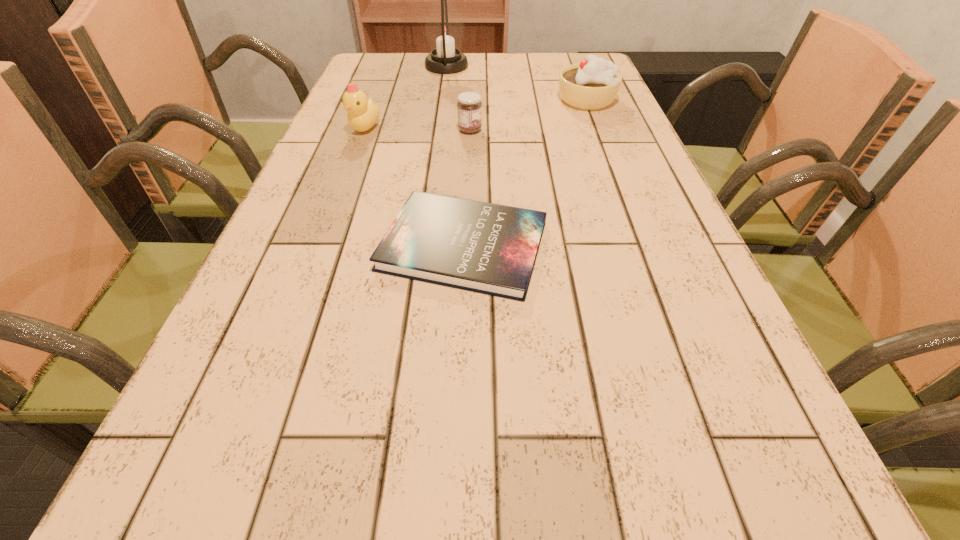
Locate an element on the screen. The width and height of the screenshot is (960, 540). vacant space situated 0.170m on the front-facing side of the leftmost object is located at coordinates [346, 180].

Where is `vacant point located 0.080m on the front label of the fourth tallest object`? The image size is (960, 540). vacant point located 0.080m on the front label of the fourth tallest object is located at coordinates (515, 130).

Identify the location of blank space located on the right of the hardback book. (643, 246).

This screenshot has width=960, height=540. I want to click on object at the far edge, so click(444, 28).

What are the coordinates of `object that is positioned at the left edge` in the screenshot? It's located at (362, 115).

What are the coordinates of `object situated at the right edge` in the screenshot? It's located at (593, 84).

At what (x,y) coordinates should I click in order to perform the action: click on vacant space at the far edge of the desktop. Please return your answer as a coordinate pair (x, y). This screenshot has height=540, width=960. Looking at the image, I should click on (494, 83).

Find the location of a particular element. blank space at the left edge of the desktop is located at coordinates (341, 249).

Where is `vacant space at the right edge`? vacant space at the right edge is located at coordinates (676, 451).

Locate an element on the screen. Image resolution: width=960 pixels, height=540 pixels. free space between the rightmost object and the shortest object is located at coordinates (525, 173).